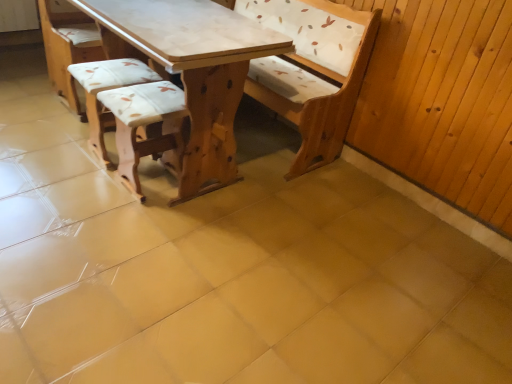
Locate an element on the screen. vacant space to the left of white fabric cushion at center, the first armchair in the left-to-right sequence is located at coordinates (57, 145).